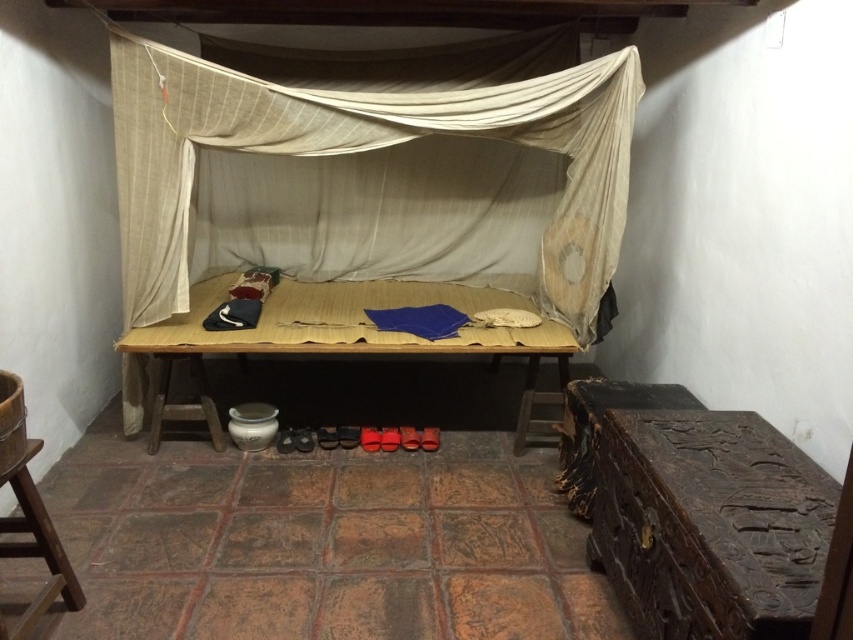
Question: Is beige fabric canopy bed at center closer to camera compared to wooden table at center?

Choices:
 (A) yes
 (B) no

Answer: (A)

Question: Among these points, which one is nearest to the camera?

Choices:
 (A) (535, 394)
 (B) (521, 196)

Answer: (A)

Question: Is beige fabric canopy bed at center wider than wooden table at center?

Choices:
 (A) no
 (B) yes

Answer: (B)

Question: Can you confirm if beige fabric canopy bed at center is wider than wooden table at center?

Choices:
 (A) yes
 (B) no

Answer: (A)